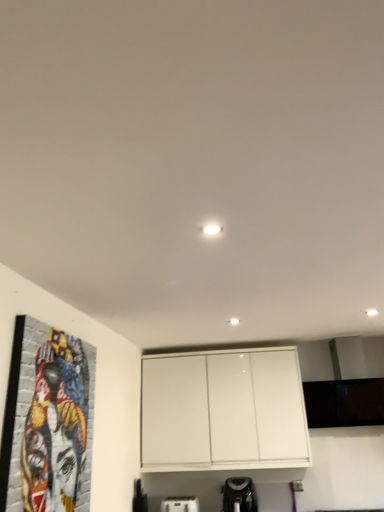
Describe the element at coordinates (56, 426) in the screenshot. I see `colorful mosaic portrait at left` at that location.

The image size is (384, 512). In order to click on white glossy cabinet at upper center in this screenshot , I will do pyautogui.click(x=223, y=411).

Find the location of a particular element. This screenshot has height=512, width=384. white plastic toaster at lower center, the first appliance when ordered from left to right is located at coordinates point(180,504).

How distant is white plastic toaster at lower center, the second appliance viewed from the right, from colorful mosaic portrait at left?

white plastic toaster at lower center, the second appliance viewed from the right, is 6.78 feet from colorful mosaic portrait at left.

Looking at this image, considering the relative sizes of white plastic toaster at lower center, the second appliance viewed from the right, and colorful mosaic portrait at left in the image provided, is white plastic toaster at lower center, the second appliance viewed from the right, smaller than colorful mosaic portrait at left?

Yes.

Is white plastic toaster at lower center, the second appliance viewed from the right, looking in the opposite direction of colorful mosaic portrait at left?

No, white plastic toaster at lower center, the second appliance viewed from the right, is not facing away from colorful mosaic portrait at left.

From a real-world perspective, which appliance is the 2nd one underneath the colorful mosaic portrait at left? Please provide its 2D coordinates.

[(180, 504)]

What's the angular difference between colorful mosaic portrait at left and black plastic coffee maker at lower center, the second appliance viewed from the left,'s facing directions?

They differ by 89.4 degrees in their facing directions.

From a real-world perspective, is colorful mosaic portrait at left over black plastic coffee maker at lower center, the second appliance viewed from the left?

Correct, in the physical world, colorful mosaic portrait at left is higher than black plastic coffee maker at lower center, the second appliance viewed from the left.

The image size is (384, 512). In order to click on mural located above the black plastic coffee maker at lower center, marked as the first appliance in a right-to-left arrangement (from the image's perspective) in this screenshot , I will do `click(56, 426)`.

Considering the positions of objects colorful mosaic portrait at left and white plastic toaster at lower center, the second appliance viewed from the right, in the image provided, who is more to the right, colorful mosaic portrait at left or white plastic toaster at lower center, the second appliance viewed from the right,?

white plastic toaster at lower center, the second appliance viewed from the right, is more to the right.

Locate an element on the screen. Image resolution: width=384 pixels, height=512 pixels. the 1st appliance counting from the right side of the colorful mosaic portrait at left is located at coordinates (180, 504).

Considering the sizes of objects colorful mosaic portrait at left and white plastic toaster at lower center, the second appliance viewed from the right, in the image provided, who is thinner, colorful mosaic portrait at left or white plastic toaster at lower center, the second appliance viewed from the right,?

With smaller width is colorful mosaic portrait at left.

Starting from the colorful mosaic portrait at left, which appliance is the 2nd one to the right? Please provide its 2D coordinates.

[(239, 495)]

From their relative heights in the image, would you say black plastic coffee maker at lower center, the second appliance viewed from the left, is taller or shorter than colorful mosaic portrait at left?

Clearly, black plastic coffee maker at lower center, the second appliance viewed from the left, is shorter compared to colorful mosaic portrait at left.

Is black plastic coffee maker at lower center, marked as the first appliance in a right-to-left arrangement, closer to camera compared to colorful mosaic portrait at left?

No, black plastic coffee maker at lower center, marked as the first appliance in a right-to-left arrangement, is behind colorful mosaic portrait at left.

Which of these two, black plastic coffee maker at lower center, marked as the first appliance in a right-to-left arrangement, or colorful mosaic portrait at left, is smaller?

black plastic coffee maker at lower center, marked as the first appliance in a right-to-left arrangement.

From a real-world perspective, is black plastic coffee maker at lower center, the second appliance viewed from the left, positioned over white plastic toaster at lower center, the first appliance when ordered from left to right, based on gravity?

Yes, from a real-world perspective, black plastic coffee maker at lower center, the second appliance viewed from the left, is on top of white plastic toaster at lower center, the first appliance when ordered from left to right.

Which object is further away from the camera, black plastic coffee maker at lower center, the second appliance viewed from the left, or white plastic toaster at lower center, the second appliance viewed from the right?

Positioned behind is white plastic toaster at lower center, the second appliance viewed from the right.

Consider the image. Looking at their sizes, would you say black plastic coffee maker at lower center, the second appliance viewed from the left, is wider or thinner than white plastic toaster at lower center, the second appliance viewed from the right?

Considering their sizes, black plastic coffee maker at lower center, the second appliance viewed from the left, looks broader than white plastic toaster at lower center, the second appliance viewed from the right.

From the image's perspective, which one is positioned lower, white plastic toaster at lower center, the second appliance viewed from the right, or white glossy cabinet at upper center?

white plastic toaster at lower center, the second appliance viewed from the right, from the image's perspective.

Between point (197, 498) and point (306, 425), which one is positioned behind?

The point (197, 498) is farther.

Is white plastic toaster at lower center, the first appliance when ordered from left to right, beside white glossy cabinet at upper center?

They are not placed beside each other.

Is white glossy cabinet at upper center taller or shorter than white plastic toaster at lower center, the first appliance when ordered from left to right?

In the image, white glossy cabinet at upper center appears to be taller than white plastic toaster at lower center, the first appliance when ordered from left to right.

Considering the sizes of objects white glossy cabinet at upper center and white plastic toaster at lower center, the first appliance when ordered from left to right, in the image provided, who is smaller, white glossy cabinet at upper center or white plastic toaster at lower center, the first appliance when ordered from left to right,?

white plastic toaster at lower center, the first appliance when ordered from left to right, is smaller.

Is point (263, 418) closer or farther from the camera than point (175, 507)?

Point (263, 418) is positioned closer to the camera compared to point (175, 507).

Could you tell me if white glossy cabinet at upper center is turned towards white plastic toaster at lower center, the first appliance when ordered from left to right?

No, white glossy cabinet at upper center is not facing towards white plastic toaster at lower center, the first appliance when ordered from left to right.

The width and height of the screenshot is (384, 512). In order to click on mural that appears on the left of white plastic toaster at lower center, the second appliance viewed from the right in this screenshot , I will do `click(56, 426)`.

I want to click on mural that appears above the black plastic coffee maker at lower center, marked as the first appliance in a right-to-left arrangement (from the image's perspective), so (x=56, y=426).

Which object lies nearer to the anchor point colorful mosaic portrait at left, black plastic coffee maker at lower center, the second appliance viewed from the left, or white plastic toaster at lower center, the second appliance viewed from the right?

Based on the image, black plastic coffee maker at lower center, the second appliance viewed from the left, appears to be nearer to colorful mosaic portrait at left.

Based on their spatial positions, is black plastic coffee maker at lower center, marked as the first appliance in a right-to-left arrangement, or colorful mosaic portrait at left closer to white glossy cabinet at upper center?

black plastic coffee maker at lower center, marked as the first appliance in a right-to-left arrangement, lies closer to white glossy cabinet at upper center than the other object.

Looking at the image, which one is located further to white plastic toaster at lower center, the first appliance when ordered from left to right, white glossy cabinet at upper center or black plastic coffee maker at lower center, marked as the first appliance in a right-to-left arrangement?

white glossy cabinet at upper center is further to white plastic toaster at lower center, the first appliance when ordered from left to right.

Considering their positions, is colorful mosaic portrait at left positioned further to black plastic coffee maker at lower center, marked as the first appliance in a right-to-left arrangement, than white glossy cabinet at upper center?

Among the two, colorful mosaic portrait at left is located further to black plastic coffee maker at lower center, marked as the first appliance in a right-to-left arrangement.

Estimate the real-world distances between objects in this image. Which object is closer to white plastic toaster at lower center, the first appliance when ordered from left to right, black plastic coffee maker at lower center, marked as the first appliance in a right-to-left arrangement, or white glossy cabinet at upper center?

black plastic coffee maker at lower center, marked as the first appliance in a right-to-left arrangement, lies closer to white plastic toaster at lower center, the first appliance when ordered from left to right, than the other object.

When comparing their distances from colorful mosaic portrait at left, does black plastic coffee maker at lower center, the second appliance viewed from the left, or white glossy cabinet at upper center seem further?

black plastic coffee maker at lower center, the second appliance viewed from the left.

Estimate the real-world distances between objects in this image. Which object is further from black plastic coffee maker at lower center, marked as the first appliance in a right-to-left arrangement, colorful mosaic portrait at left or white plastic toaster at lower center, the second appliance viewed from the right?

Based on the image, colorful mosaic portrait at left appears to be further to black plastic coffee maker at lower center, marked as the first appliance in a right-to-left arrangement.

Which object lies nearer to the anchor point black plastic coffee maker at lower center, marked as the first appliance in a right-to-left arrangement, white glossy cabinet at upper center or colorful mosaic portrait at left?

Based on the image, white glossy cabinet at upper center appears to be nearer to black plastic coffee maker at lower center, marked as the first appliance in a right-to-left arrangement.

Find the location of a particular element. This screenshot has width=384, height=512. appliance between colorful mosaic portrait at left and white plastic toaster at lower center, the first appliance when ordered from left to right, in the front-back direction is located at coordinates (239, 495).

Locate an element on the screen. appliance between white glossy cabinet at upper center and white plastic toaster at lower center, the second appliance viewed from the right, vertically is located at coordinates (239, 495).